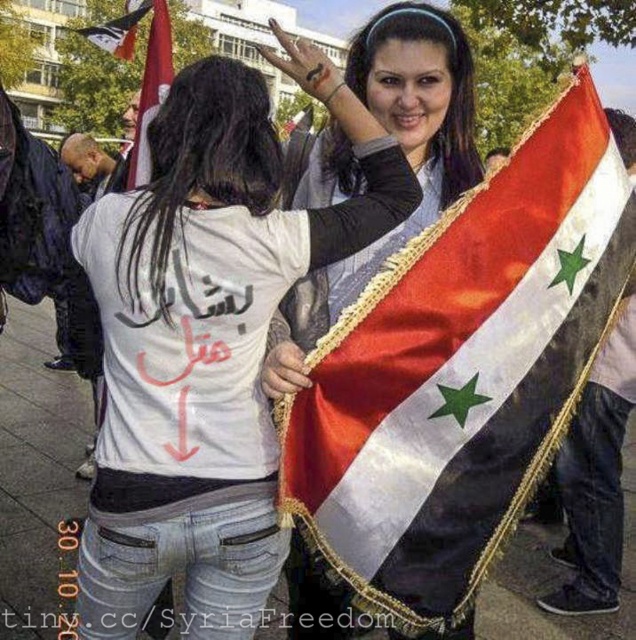
Who is lower down, white matte t-shirt at center or red fabric flag at upper left?

white matte t-shirt at center

Does point (130, 381) come farther from viewer compared to point (169, 49)?

No, it is in front of (169, 49).

This screenshot has height=640, width=636. In order to click on white matte t-shirt at center in this screenshot , I will do `click(205, 346)`.

Between silky fabric flag at upper right and white matte t-shirt at center, which one is positioned lower?

silky fabric flag at upper right is below.

Can you confirm if silky fabric flag at upper right is bigger than white matte t-shirt at center?

No, silky fabric flag at upper right is not bigger than white matte t-shirt at center.

In the scene shown: Who is more distant from viewer, (343, 563) or (113, 612)?

The point (343, 563) is more distant.

Identify the location of silky fabric flag at upper right. (460, 372).

Does white matte t-shirt at center appear on the right side of black fabric flag at upper left?

Indeed, white matte t-shirt at center is positioned on the right side of black fabric flag at upper left.

Who is positioned more to the right, white matte t-shirt at center or black fabric flag at upper left?

From the viewer's perspective, white matte t-shirt at center appears more on the right side.

Is point (245, 522) farther from viewer compared to point (92, 32)?

No, (245, 522) is in front of (92, 32).

Locate an element on the screen. Image resolution: width=636 pixels, height=640 pixels. white matte t-shirt at center is located at coordinates (205, 346).